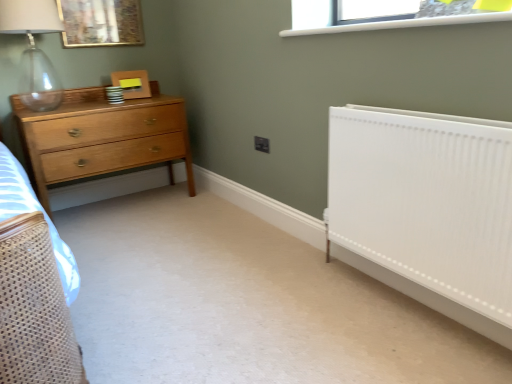
The image size is (512, 384). What do you see at coordinates (102, 137) in the screenshot?
I see `light brown wood chest of drawers at left` at bounding box center [102, 137].

Looking at this image, measure the distance between point (x=129, y=43) and camera.

Point (x=129, y=43) and camera are 9.69 feet apart from each other.

This screenshot has width=512, height=384. Identify the location of clear glass window at upper center. (388, 20).

In terms of width, does clear glass window at upper center look wider or thinner when compared to gold-framed picture at upper left?

clear glass window at upper center is wider than gold-framed picture at upper left.

Is clear glass window at upper center positioned behind gold-framed picture at upper left?

No, clear glass window at upper center is closer to the camera.

In terms of size, does clear glass window at upper center appear bigger or smaller than gold-framed picture at upper left?

Clearly, clear glass window at upper center is larger in size than gold-framed picture at upper left.

From a real-world perspective, is clear glass window at upper center located higher than gold-framed picture at upper left?

No, from a real-world perspective, clear glass window at upper center is not above gold-framed picture at upper left.

Between point (331, 205) and point (114, 29), which one is positioned in front?

The point (331, 205) is more forward.

Are white smooth radiator at right and gold-framed picture at upper left far apart?

Indeed, white smooth radiator at right is not near gold-framed picture at upper left.

Considering the relative sizes of white smooth radiator at right and gold-framed picture at upper left in the image provided, is white smooth radiator at right thinner than gold-framed picture at upper left?

In fact, white smooth radiator at right might be wider than gold-framed picture at upper left.

Is point (375, 150) positioned after point (27, 55)?

No.

Between white smooth radiator at right and transparent glass lamp at upper left, which one has more height?

Standing taller between the two is white smooth radiator at right.

Which is more to the right, white smooth radiator at right or transparent glass lamp at upper left?

white smooth radiator at right is more to the right.

Based on the photo, is white smooth radiator at right facing away from transparent glass lamp at upper left?

No, transparent glass lamp at upper left is not at the back of white smooth radiator at right.

Considering the positions of points (174, 142) and (2, 12), is point (174, 142) closer to camera compared to point (2, 12)?

No, it is behind (2, 12).

Is light brown wood chest of drawers at left turned away from transparent glass lamp at upper left?

No, light brown wood chest of drawers at left is not facing away from transparent glass lamp at upper left.

Considering the sizes of objects light brown wood chest of drawers at left and transparent glass lamp at upper left in the image provided, who is bigger, light brown wood chest of drawers at left or transparent glass lamp at upper left?

With larger size is light brown wood chest of drawers at left.

Considering the sizes of light brown wood chest of drawers at left and transparent glass lamp at upper left in the image, is light brown wood chest of drawers at left wider or thinner than transparent glass lamp at upper left?

light brown wood chest of drawers at left is wider than transparent glass lamp at upper left.

Is light brown wood chest of drawers at left directly adjacent to clear glass window at upper center?

No, light brown wood chest of drawers at left is not with clear glass window at upper center.

Considering the relative sizes of light brown wood chest of drawers at left and clear glass window at upper center in the image provided, is light brown wood chest of drawers at left wider than clear glass window at upper center?

Indeed, light brown wood chest of drawers at left has a greater width compared to clear glass window at upper center.

From the image's perspective, would you say light brown wood chest of drawers at left is positioned over clear glass window at upper center?

Incorrect, from the image's perspective, light brown wood chest of drawers at left is lower than clear glass window at upper center.

Is transparent glass lamp at upper left far from gold-framed picture at upper left?

transparent glass lamp at upper left is actually quite close to gold-framed picture at upper left.

From the image's perspective, is transparent glass lamp at upper left located beneath gold-framed picture at upper left?

Yes, from the image's perspective, transparent glass lamp at upper left is beneath gold-framed picture at upper left.

Can you confirm if transparent glass lamp at upper left is bigger than gold-framed picture at upper left?

Yes, transparent glass lamp at upper left is bigger than gold-framed picture at upper left.

Which of these two, transparent glass lamp at upper left or gold-framed picture at upper left, stands taller?

transparent glass lamp at upper left.

Is transparent glass lamp at upper left aimed at clear glass window at upper center?

No, transparent glass lamp at upper left is not turned towards clear glass window at upper center.

Which object is wider, transparent glass lamp at upper left or clear glass window at upper center?

transparent glass lamp at upper left.

Can you confirm if transparent glass lamp at upper left is bigger than clear glass window at upper center?

Yes.

Does point (29, 63) appear closer or farther from the camera than point (332, 27)?

Point (29, 63) is farther from the camera than point (332, 27).

Identify the location of picture frame behind the clear glass window at upper center. (101, 23).

The width and height of the screenshot is (512, 384). I want to click on radiator located underneath the gold-framed picture at upper left (from a real-world perspective), so click(x=428, y=206).

When comparing their distances from white smooth radiator at right, does gold-framed picture at upper left or transparent glass lamp at upper left seem further?

The object further to white smooth radiator at right is gold-framed picture at upper left.

Considering their positions, is light brown wood chest of drawers at left positioned closer to transparent glass lamp at upper left than white smooth radiator at right?

Among the two, light brown wood chest of drawers at left is located nearer to transparent glass lamp at upper left.

Considering their positions, is transparent glass lamp at upper left positioned further to gold-framed picture at upper left than light brown wood chest of drawers at left?

light brown wood chest of drawers at left is positioned further to the anchor gold-framed picture at upper left.

Which object lies further to the anchor point light brown wood chest of drawers at left, clear glass window at upper center or gold-framed picture at upper left?

clear glass window at upper center lies further to light brown wood chest of drawers at left than the other object.

Based on their spatial positions, is gold-framed picture at upper left or clear glass window at upper center closer to transparent glass lamp at upper left?

gold-framed picture at upper left lies closer to transparent glass lamp at upper left than the other object.

When comparing their distances from gold-framed picture at upper left, does light brown wood chest of drawers at left or clear glass window at upper center seem further?

The object further to gold-framed picture at upper left is clear glass window at upper center.

From the image, which object appears to be nearer to transparent glass lamp at upper left, clear glass window at upper center or gold-framed picture at upper left?

gold-framed picture at upper left is positioned closer to the anchor transparent glass lamp at upper left.

Based on their spatial positions, is gold-framed picture at upper left or light brown wood chest of drawers at left further from transparent glass lamp at upper left?

gold-framed picture at upper left is further to transparent glass lamp at upper left.

The height and width of the screenshot is (384, 512). Find the location of `window situated between light brown wood chest of drawers at left and white smooth radiator at right from left to right`. window situated between light brown wood chest of drawers at left and white smooth radiator at right from left to right is located at coordinates (388, 20).

Where is `window located between transparent glass lamp at upper left and white smooth radiator at right in the left-right direction`? This screenshot has height=384, width=512. window located between transparent glass lamp at upper left and white smooth radiator at right in the left-right direction is located at coordinates (388, 20).

Where is `chest of drawers between gold-framed picture at upper left and clear glass window at upper center`? chest of drawers between gold-framed picture at upper left and clear glass window at upper center is located at coordinates (102, 137).

Where is `picture frame situated between transparent glass lamp at upper left and white smooth radiator at right from left to right`? picture frame situated between transparent glass lamp at upper left and white smooth radiator at right from left to right is located at coordinates (101, 23).